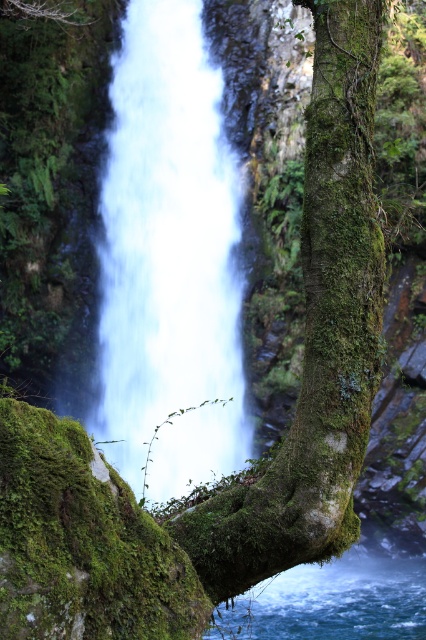
From the picture: You are a photographer planning to capture the waterfall and the tree trunk in the same frame. Based on the scene, which object is shorter in height between the white frothy water at center and the green mossy tree trunk at center?

The white frothy water at center has a lesser height compared to the green mossy tree trunk at center, so the white frothy water at center is shorter in height.

Looking at the waterfall scene, which object is smaller in size between the white frothy water at center and the clear blue water at lower center?

The white frothy water at center is smaller in size compared to the clear blue water at lower center.

Consider the image. You are a photographer planning to capture the waterfall scene. You want to ensure the green mossy tree trunk at center and the clear blue water at lower center are both visible in your shot. Based on their positions, which object should you focus on first to ensure both are in frame?

The green mossy tree trunk at center is positioned over clear blue water at lower center, so focusing on the tree trunk first will naturally include the water below it in the frame.